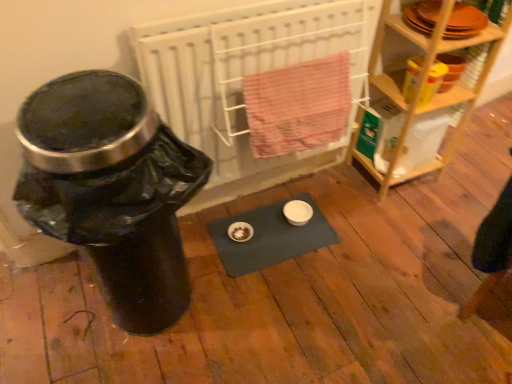
Image resolution: width=512 pixels, height=384 pixels. Identify the location of free space between wooden shelf at right and black plastic water cooler at left. (293, 228).